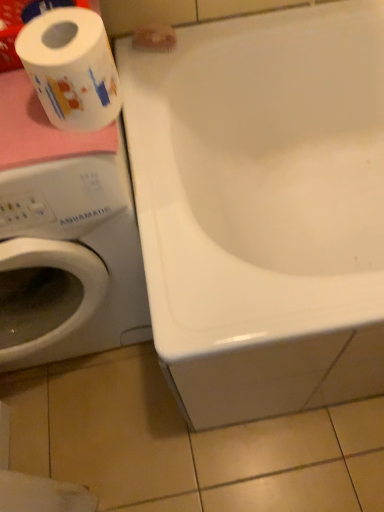
Question: From a real-world perspective, is white printed toilet paper at left, marked as the 1th toilet paper in a bottom-to-top arrangement, over white glossy bathtub at upper center?

Choices:
 (A) yes
 (B) no

Answer: (A)

Question: Is white printed toilet paper at left, which is counted as the 1th toilet paper, starting from the front, not inside white glossy bathtub at upper center?

Choices:
 (A) no
 (B) yes

Answer: (B)

Question: Is white printed toilet paper at left, which is counted as the 2th toilet paper, starting from the back, looking in the opposite direction of white glossy bathtub at upper center?

Choices:
 (A) no
 (B) yes

Answer: (A)

Question: Is white printed toilet paper at left, marked as the 1th toilet paper in a bottom-to-top arrangement, aimed at white glossy bathtub at upper center?

Choices:
 (A) yes
 (B) no

Answer: (B)

Question: Is white printed toilet paper at left, which is counted as the 1th toilet paper, starting from the front, wider than white glossy bathtub at upper center?

Choices:
 (A) no
 (B) yes

Answer: (A)

Question: From their relative heights in the image, would you say white printed toilet paper at left, marked as the 1th toilet paper in a bottom-to-top arrangement, is taller or shorter than white matte toilet paper at upper center, the 1th toilet paper from the top?

Choices:
 (A) tall
 (B) short

Answer: (A)

Question: Looking at the image, does white printed toilet paper at left, which is counted as the 2th toilet paper, starting from the back, seem bigger or smaller compared to white matte toilet paper at upper center, the 1th toilet paper from the top?

Choices:
 (A) small
 (B) big

Answer: (B)

Question: Would you say white printed toilet paper at left, marked as the 1th toilet paper in a bottom-to-top arrangement, is inside or outside white matte toilet paper at upper center, the 2th toilet paper in the bottom-to-top sequence?

Choices:
 (A) inside
 (B) outside

Answer: (B)

Question: In terms of width, does white printed toilet paper at left, marked as the 1th toilet paper in a bottom-to-top arrangement, look wider or thinner when compared to white matte toilet paper at upper center, the 2th toilet paper in the bottom-to-top sequence?

Choices:
 (A) wide
 (B) thin

Answer: (A)

Question: Is white matte toilet paper at upper center, arranged as the second toilet paper when viewed from the front, in front of or behind white printed toilet paper at left, which is counted as the 2th toilet paper, starting from the back, in the image?

Choices:
 (A) behind
 (B) front

Answer: (A)

Question: Is white matte toilet paper at upper center, placed as the 1th toilet paper when sorted from back to front, inside or outside of white printed toilet paper at left, which is counted as the 2th toilet paper, starting from the back?

Choices:
 (A) outside
 (B) inside

Answer: (A)

Question: Is point (137, 39) closer or farther from the camera than point (31, 71)?

Choices:
 (A) farther
 (B) closer

Answer: (A)

Question: From the image's perspective, is white matte toilet paper at upper center, arranged as the second toilet paper when viewed from the front, positioned above or below white printed toilet paper at left, which is counted as the 2th toilet paper, starting from the back?

Choices:
 (A) below
 (B) above

Answer: (B)

Question: Considering the positions of white matte toilet paper at upper center, the 1th toilet paper from the top, and white glossy bathtub at upper center in the image, is white matte toilet paper at upper center, the 1th toilet paper from the top, wider or thinner than white glossy bathtub at upper center?

Choices:
 (A) wide
 (B) thin

Answer: (B)

Question: From a real-world perspective, is white matte toilet paper at upper center, the 1th toilet paper from the top, positioned above or below white glossy bathtub at upper center?

Choices:
 (A) below
 (B) above

Answer: (B)